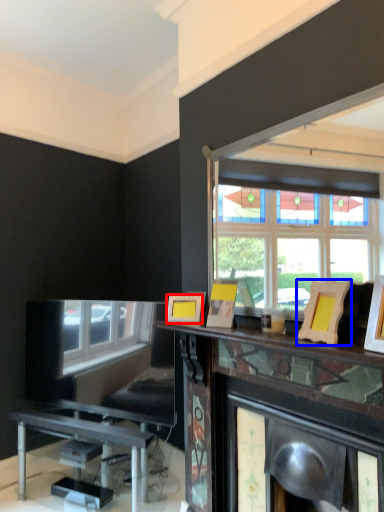
Question: Which point is further to the camera, picture frame (highlighted by a red box) or picture frame (highlighted by a blue box)?

Choices:
 (A) picture frame
 (B) picture frame

Answer: (A)